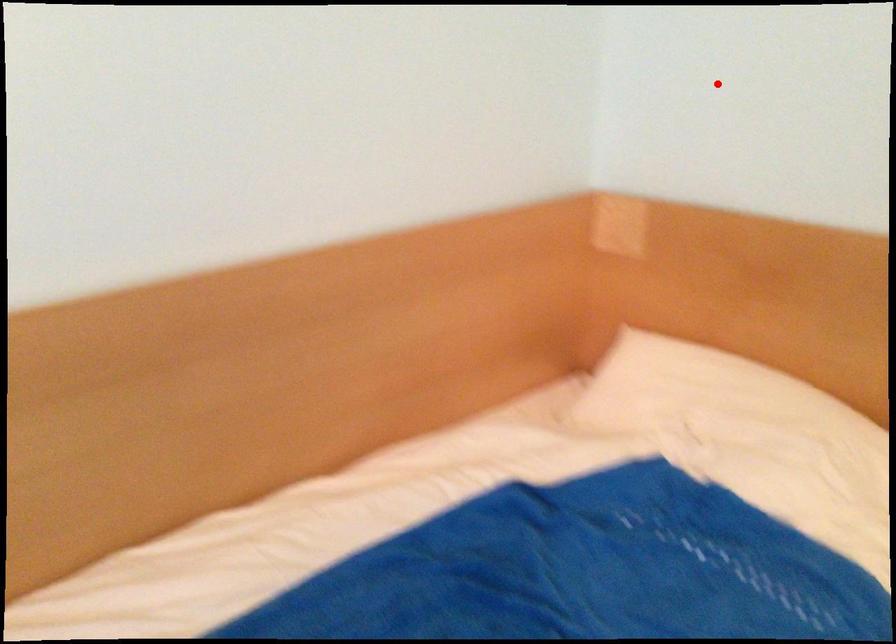
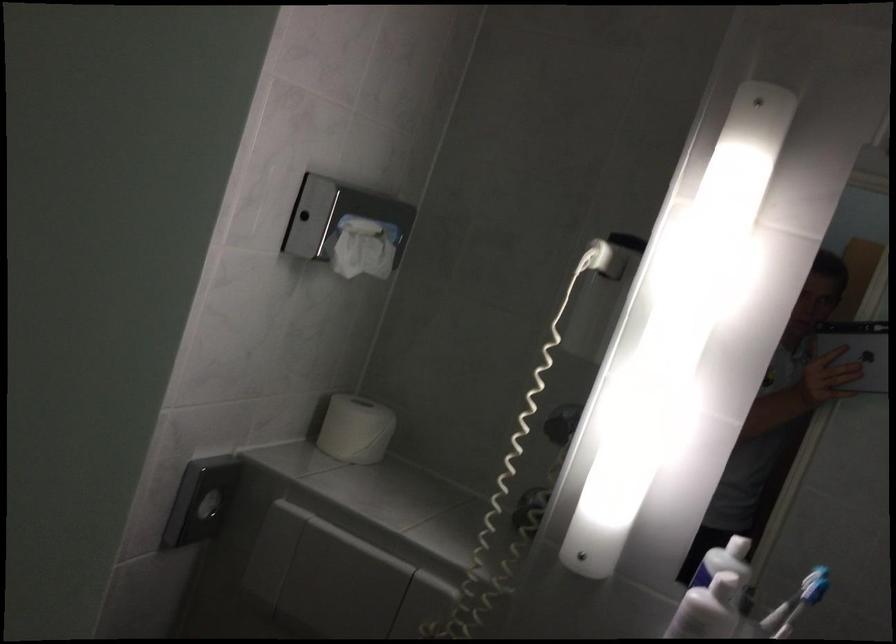
Question: I am providing you with two images of the same scene from different viewpoints. Image1 has a red point marked. In image2, the corresponding 3D location appears at what relative position? Reply with the corresponding letter.

Choices:
 (A) Closer
 (B) Farther

Answer: (A)